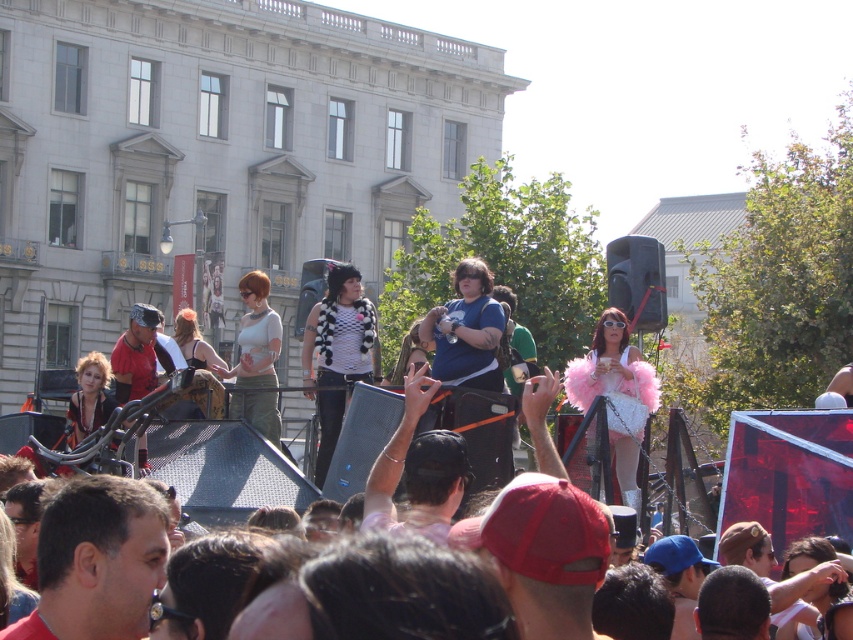
You are a photographer at the event and want to capture both the dark brown leather jacket at center and the black and white fur vest at center in a single photo. Which clothing item should you focus on first to ensure both are in frame?

The dark brown leather jacket at center is shorter than the black and white fur vest at center, so focusing on the taller black and white fur vest at center first will help ensure both are in frame.

You are a photographer at the event and want to capture both the dark brown leather jacket at center and the black and white fur vest at center in the same frame. Based on their positions, which one should you focus on first to ensure both are in the shot?

The dark brown leather jacket at center is to the right of the black and white fur vest at center, so you should focus on the black and white fur vest at center first to ensure both are in the shot.

You are a photographer at the event and want to capture a photo of the dark brown leather jacket at center. The stage is at coordinates 0.7, 0.5. Where should you position your camera to ensure the jacket is in the frame?

The dark brown leather jacket at center is located at point [416,470], which is very close to the stage coordinates at [426,448]. Position your camera near the stage area to capture the jacket in the frame.